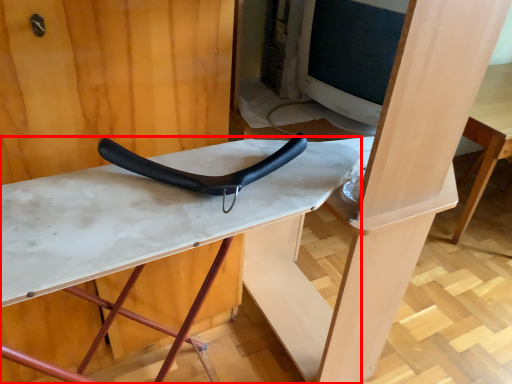
Question: From the image's perspective, where is table (annotated by the red box) located in relation to handle in the image?

Choices:
 (A) below
 (B) above

Answer: (A)